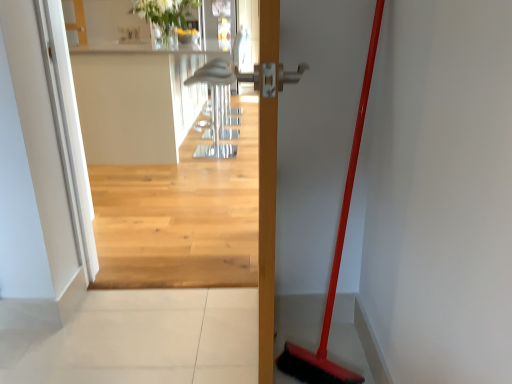
Question: Based on their positions, is white glossy vase at upper center located to the left or right of red plastic broom at right?

Choices:
 (A) left
 (B) right

Answer: (A)

Question: Is white glossy vase at upper center inside or outside of red plastic broom at right?

Choices:
 (A) inside
 (B) outside

Answer: (B)

Question: In terms of width, does white glossy vase at upper center look wider or thinner when compared to red plastic broom at right?

Choices:
 (A) thin
 (B) wide

Answer: (B)

Question: Is point (345, 370) closer or farther from the camera than point (180, 6)?

Choices:
 (A) closer
 (B) farther

Answer: (A)

Question: Based on their positions, is red plastic broom at right located to the left or right of white glossy vase at upper center?

Choices:
 (A) left
 (B) right

Answer: (B)

Question: Considering their positions, is red plastic broom at right located in front of or behind white glossy vase at upper center?

Choices:
 (A) front
 (B) behind

Answer: (A)

Question: Looking at the image, does red plastic broom at right seem bigger or smaller compared to white glossy vase at upper center?

Choices:
 (A) big
 (B) small

Answer: (B)